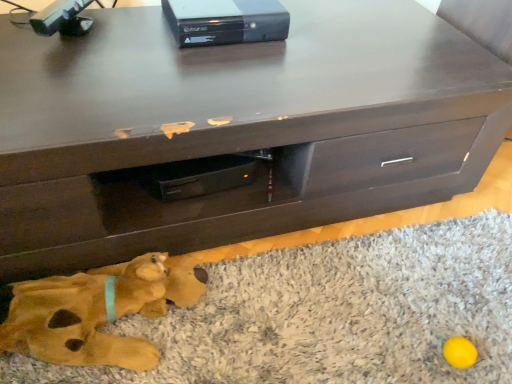
Locate an element on the screen. free space in front of black plastic game console at upper center is located at coordinates (214, 72).